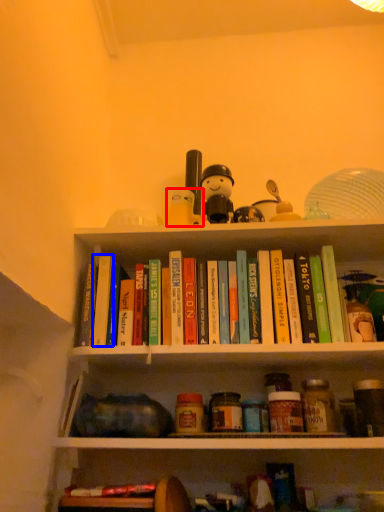
Question: Which object appears closest to the camera in this image, toy (highlighted by a red box) or paperback book (highlighted by a blue box)?

Choices:
 (A) toy
 (B) paperback book

Answer: (B)